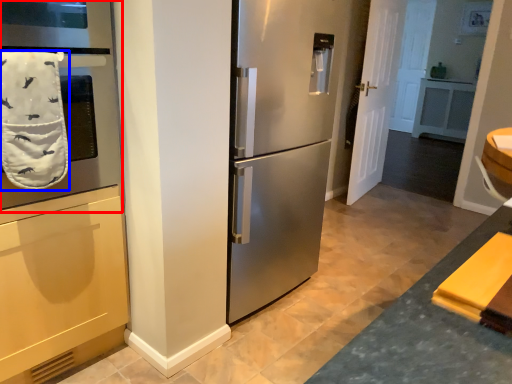
Question: Among these objects, which one is farthest to the camera, oven (highlighted by a red box) or bath towel (highlighted by a blue box)?

Choices:
 (A) oven
 (B) bath towel

Answer: (B)